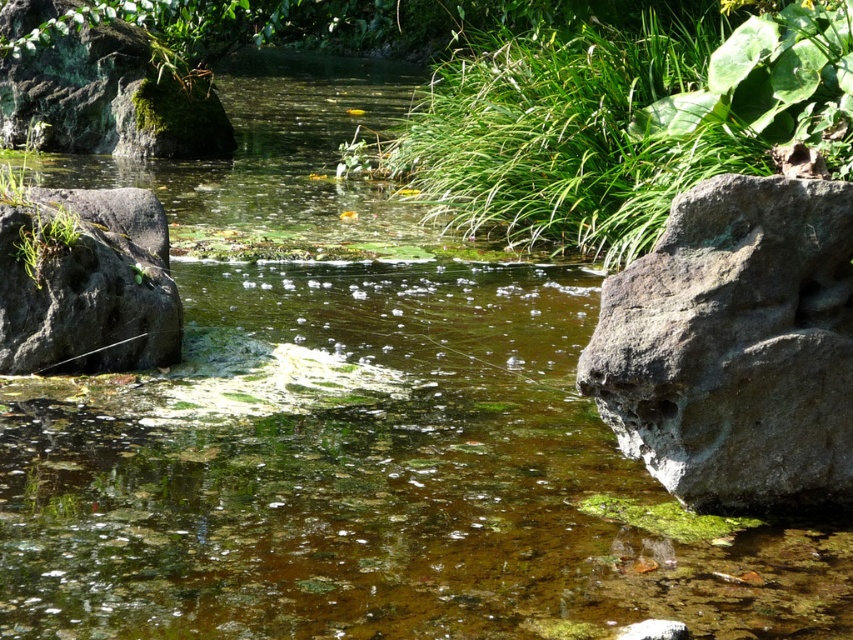
Question: From the image, what is the correct spatial relationship of green leafy plant at center in relation to green mossy rock at upper left?

Choices:
 (A) below
 (B) above

Answer: (A)

Question: Is green leafy plant at center wider than gray rough rock at right?

Choices:
 (A) yes
 (B) no

Answer: (A)

Question: Which object is positioned farthest from the gray rough rock at right?

Choices:
 (A) green mossy rock at upper left
 (B) green leafy plant at center
 (C) gray rough rock at left

Answer: (A)

Question: Can you confirm if green leafy plant at center is positioned below green mossy rock at upper left?

Choices:
 (A) yes
 (B) no

Answer: (A)

Question: Which point is farther to the camera?

Choices:
 (A) gray rough rock at right
 (B) green leafy plant at center
 (C) gray rough rock at left
 (D) green mossy rock at upper left

Answer: (D)

Question: Among these points, which one is nearest to the camera?

Choices:
 (A) (90, 115)
 (B) (819, 45)
 (C) (764, 486)
 (D) (50, 280)

Answer: (C)